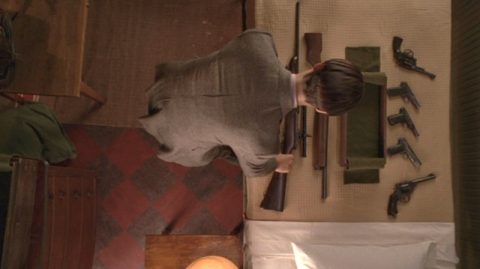
You are a GUI agent. You are given a task and a screenshot of the screen. Output one action in this format:
    pyautogui.click(x=<x>, y=<y>)
    Task: Click on the table
    This screenshot has height=269, width=480.
    Given the screenshot: What is the action you would take?
    pyautogui.click(x=61, y=49)